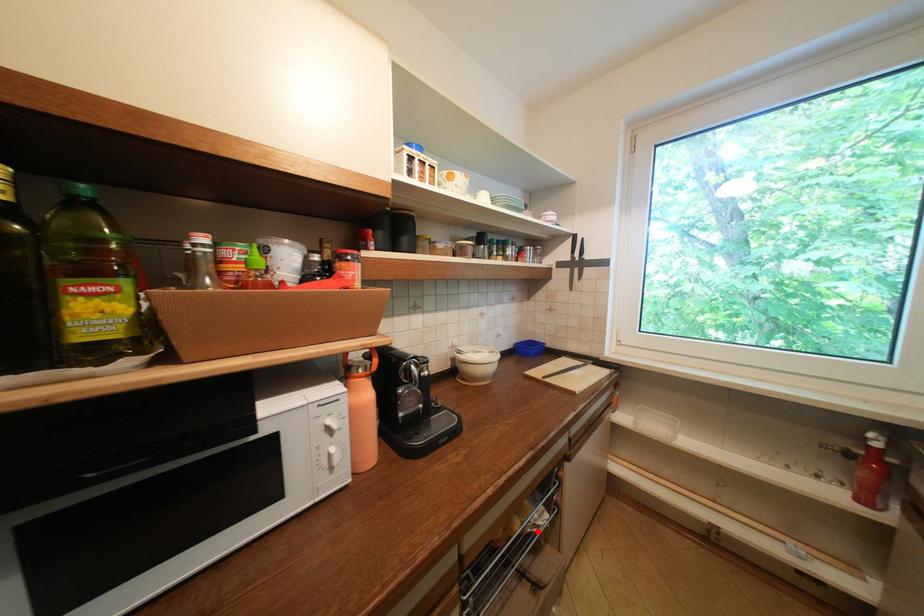
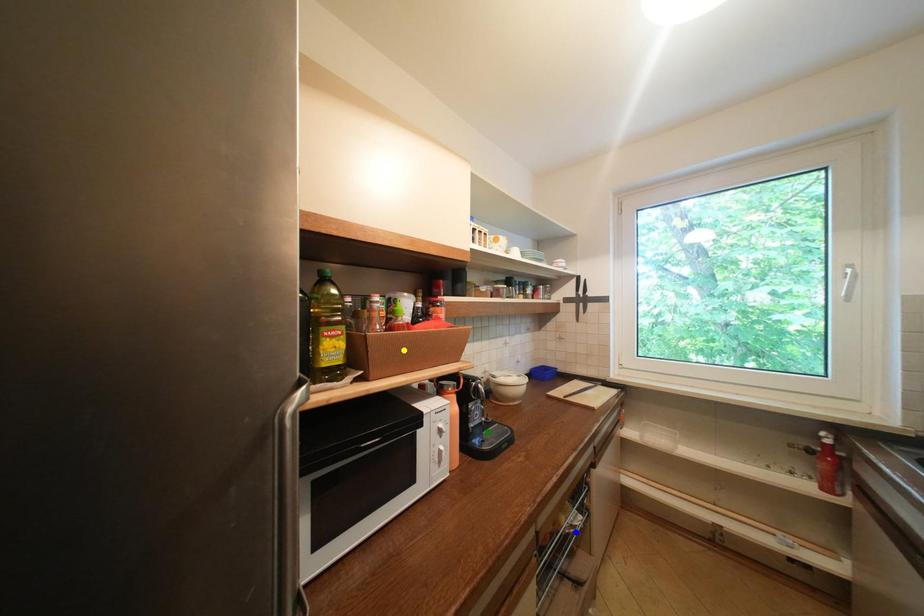
Question: I am providing you with two images of the same scene from different viewpoints. A red point is marked on the first image. You are given multiple points on the second image. Can you choose the point in image 2 that corresponds to the point in image 1?

Choices:
 (A) yellow point
 (B) green point
 (C) blue point

Answer: (C)